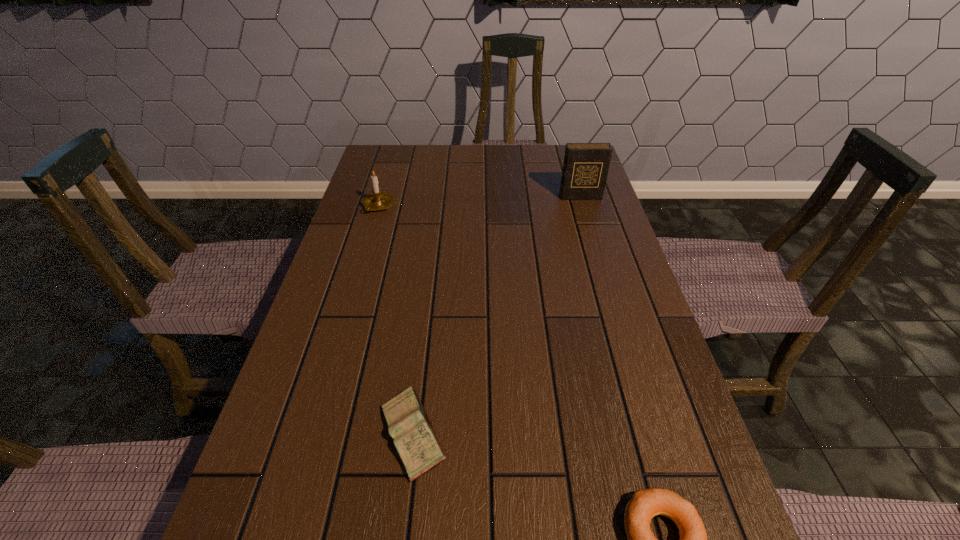
Locate an element on the screen. This screenshot has height=540, width=960. object present at the right edge is located at coordinates (585, 169).

Find the location of `vacant space at the far edge`. vacant space at the far edge is located at coordinates (484, 148).

In the image, there is a desktop. Find the location of `vacant space at the left edge`. vacant space at the left edge is located at coordinates pyautogui.click(x=350, y=256).

Find the location of a particular element. blank area at the right edge is located at coordinates (579, 220).

This screenshot has width=960, height=540. Identify the location of vacant space at the far left corner. (393, 179).

In the image, there is a desktop. Find the location of `vacant area at the far right corner`. vacant area at the far right corner is located at coordinates (547, 154).

Locate an element on the screen. Image resolution: width=960 pixels, height=540 pixels. empty space between the leftmost object and the tallest object is located at coordinates (479, 201).

Identify the location of vacant space that's between the taller diary and the third object from right to left. (496, 315).

Where is `vacant space that's between the tallest object and the second tallest object`? vacant space that's between the tallest object and the second tallest object is located at coordinates (479, 201).

Where is `the closest object to the second tallest object`? This screenshot has width=960, height=540. the closest object to the second tallest object is located at coordinates (585, 169).